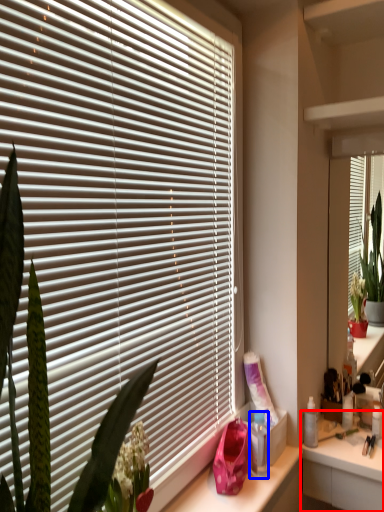
Question: Which point is closer to the camera, counter (highlighted by a red box) or bottle (highlighted by a blue box)?

Choices:
 (A) counter
 (B) bottle

Answer: (B)